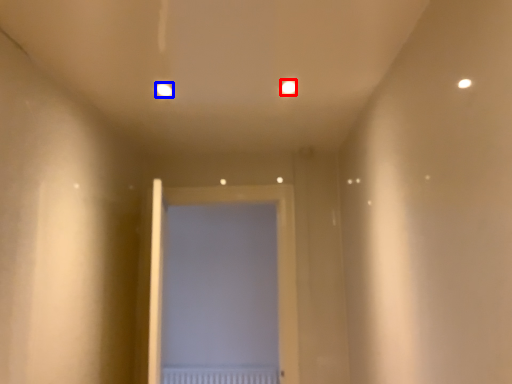
Question: Which object is further to the camera taking this photo, light (highlighted by a red box) or light (highlighted by a blue box)?

Choices:
 (A) light
 (B) light

Answer: (B)